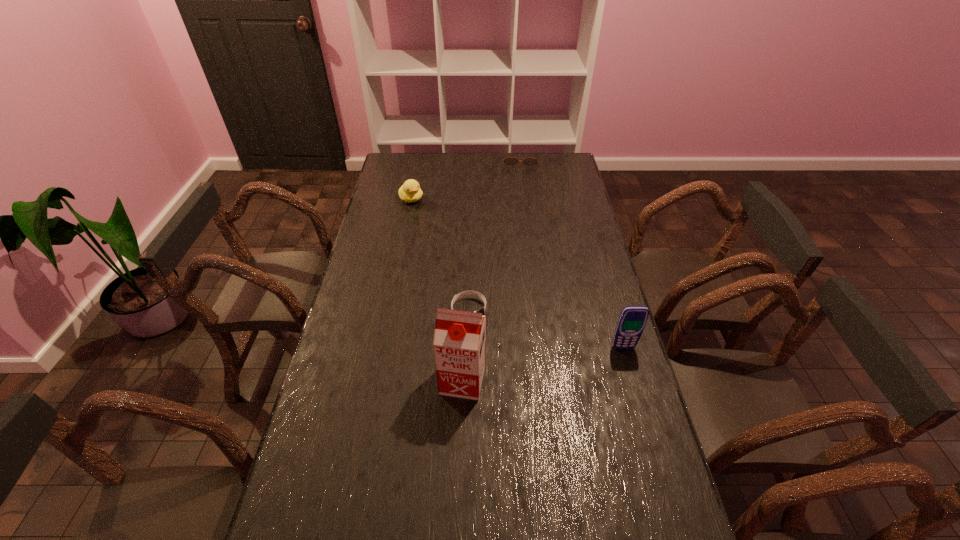
Image resolution: width=960 pixels, height=540 pixels. I want to click on blank region between the duckling and the third nearest object, so click(x=440, y=254).

This screenshot has width=960, height=540. In order to click on free space between the sunglasses and the second tallest object in this screenshot , I will do `click(571, 254)`.

Locate an element on the screen. empty space that is in between the soya milk and the farthest object is located at coordinates click(x=492, y=270).

Locate an element on the screen. blank region between the tallest object and the leftmost object is located at coordinates (437, 289).

Image resolution: width=960 pixels, height=540 pixels. Identify the location of vacant space in between the second tallest object and the nearest object. (542, 364).

This screenshot has height=540, width=960. What are the coordinates of `blank region between the wristband and the second farthest object` in the screenshot? It's located at (440, 254).

At what (x,y) coordinates should I click in order to perform the action: click on free space that is in between the third nearest object and the fourth shortest object. Please return your answer as a coordinate pair (x, y). Looking at the image, I should click on (546, 329).

The width and height of the screenshot is (960, 540). I want to click on the second closest object relative to the rightmost object, so 470,293.

Find the location of a particular element. The width and height of the screenshot is (960, 540). object that can be found as the closest to the cellular telephone is located at coordinates (459, 339).

Locate an element on the screen. Image resolution: width=960 pixels, height=540 pixels. vacant area that satisfies the following two spatial constraints: 1. on the front side of the soya milk; 2. on the left side of the leftmost object is located at coordinates [375, 380].